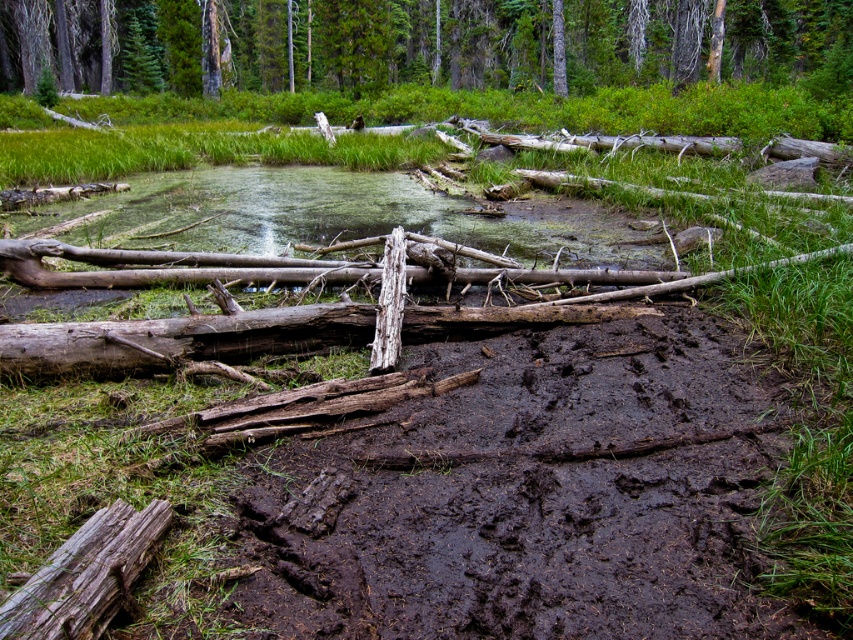
Question: Is dark brown mud at center thinner than weathered brown log at lower left?

Choices:
 (A) no
 (B) yes

Answer: (A)

Question: Which object appears farthest from the camera in this image?

Choices:
 (A) green matte tree at upper center
 (B) dark brown mud at center
 (C) weathered brown log at lower left

Answer: (A)

Question: Can you confirm if dark brown mud at center is wider than green matte tree at upper center?

Choices:
 (A) no
 (B) yes

Answer: (A)

Question: Which point is closer to the camera taking this photo?

Choices:
 (A) (585, 586)
 (B) (643, 0)

Answer: (A)

Question: Is the position of green matte tree at upper center less distant than that of weathered brown log at lower left?

Choices:
 (A) yes
 (B) no

Answer: (B)

Question: Which is nearer to the dark brown mud at center?

Choices:
 (A) weathered brown log at lower left
 (B) green matte tree at upper center

Answer: (A)